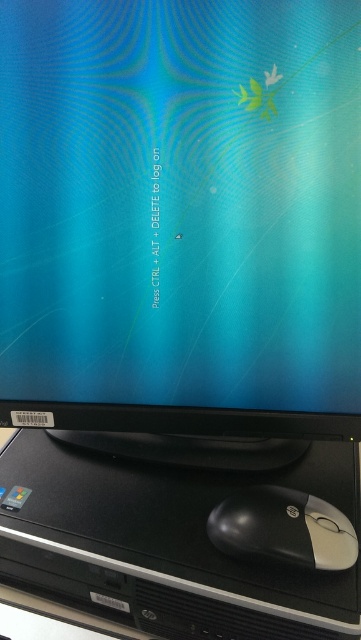
Looking at this image, is black plastic computer at bottom positioned in front of black plastic mouse at bottom right?

Yes, it is.

The height and width of the screenshot is (640, 361). Identify the location of black plastic computer at bottom. (167, 544).

The width and height of the screenshot is (361, 640). In order to click on black plastic computer at bottom in this screenshot , I will do `click(167, 544)`.